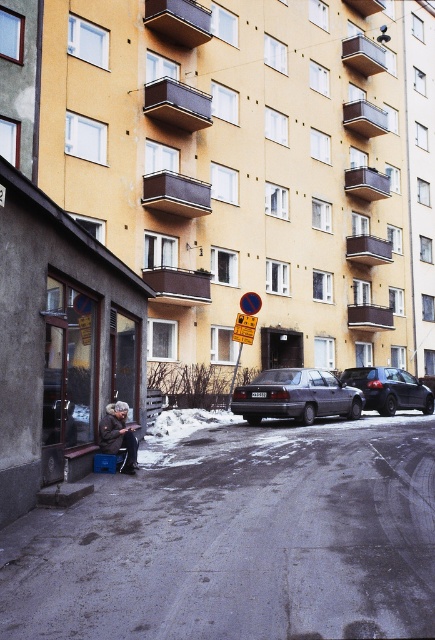
Is dark blue metallic car at center-right shorter than yellow plastic sign at center?

Correct, dark blue metallic car at center-right is not as tall as yellow plastic sign at center.

From the picture: Between dark blue metallic car at center-right and yellow plastic sign at center, which one appears on the left side from the viewer's perspective?

From the viewer's perspective, yellow plastic sign at center appears more on the left side.

Is point (395, 387) positioned after point (246, 336)?

Yes, it is.

Identify the location of dark blue metallic car at center-right. Image resolution: width=435 pixels, height=640 pixels. (388, 388).

Who is more distant from viewer, (238, 323) or (250, 296)?

Point (250, 296)

Does point (240, 336) come closer to viewer compared to point (250, 310)?

No.

Describe the element at coordinates (244, 328) in the screenshot. This screenshot has height=640, width=435. I see `yellow plastic sign at center` at that location.

Image resolution: width=435 pixels, height=640 pixels. I want to click on yellow plastic sign at center, so click(244, 328).

Is metallic reflective sign at center smaller than yellow plastic sign at center?

Yes.

Is point (244, 314) farther from viewer compared to point (251, 332)?

Yes, point (244, 314) is farther from viewer.

This screenshot has height=640, width=435. I want to click on metallic reflective sign at center, so click(x=244, y=328).